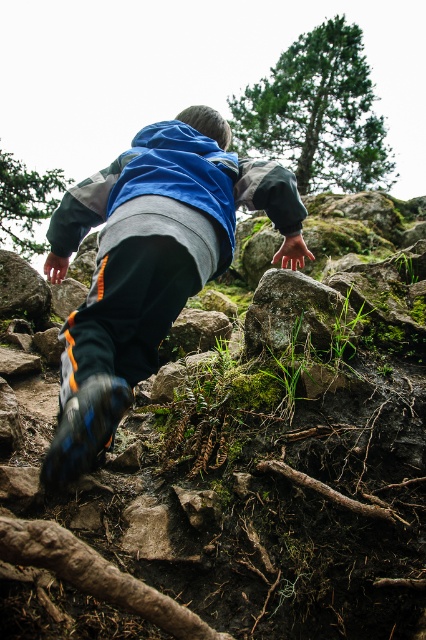
Can you confirm if mossy rock at center is positioned below blue fleece jacket at center?

Yes, mossy rock at center is below blue fleece jacket at center.

Is point (40, 636) less distant than point (275, 257)?

Yes.

This screenshot has width=426, height=640. What are the coordinates of `mossy rock at center` in the screenshot? It's located at (267, 461).

Can you confirm if mossy rock at center is taller than matte blue jacket at center?

No.

Between mossy rock at center and matte blue jacket at center, which one has more height?

matte blue jacket at center is taller.

What are the coordinates of `mossy rock at center` in the screenshot? It's located at (267, 461).

At what (x,y) coordinates should I click in order to perform the action: click on mossy rock at center. Please return your answer as a coordinate pair (x, y). Looking at the image, I should click on (267, 461).

Which is below, mossy rock at center or rough textured rock at center?

mossy rock at center

Is mossy rock at center bigger than rough textured rock at center?

Yes, mossy rock at center is bigger than rough textured rock at center.

Who is more distant from viewer, (x=42, y=518) or (x=273, y=323)?

Positioned behind is point (x=273, y=323).

Find the location of `mossy rock at center`. mossy rock at center is located at coordinates click(x=267, y=461).